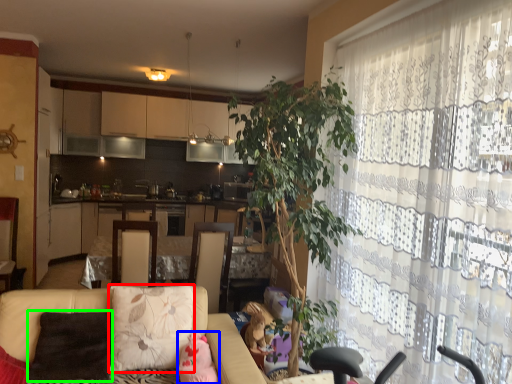
Question: Which object is positioned closest to pillow (highlighted by a red box)? Select from toy (highlighted by a blue box) and pillow (highlighted by a green box).

Choices:
 (A) toy
 (B) pillow

Answer: (B)